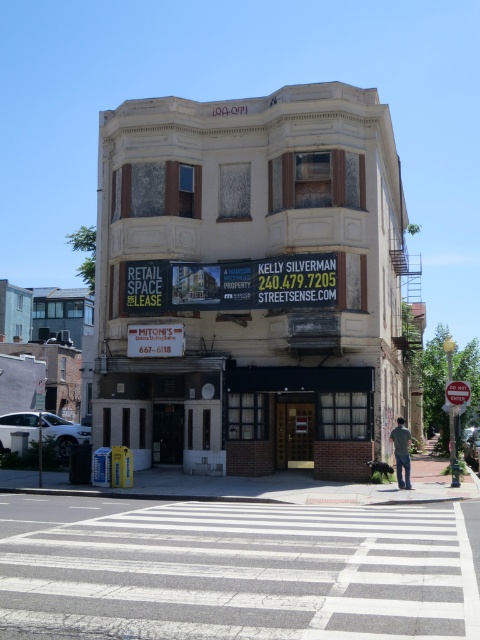
Does white brick building at center have a lesser width compared to gray cotton shirt at lower right?

Incorrect, white brick building at center's width is not less than gray cotton shirt at lower right's.

Does white brick building at center appear on the left side of gray cotton shirt at lower right?

In fact, white brick building at center is to the right of gray cotton shirt at lower right.

Who is more forward, (283, 122) or (394, 433)?

Positioned in front is point (394, 433).

Where is `white brick building at center`? The width and height of the screenshot is (480, 640). white brick building at center is located at coordinates (251, 282).

Is gray cotton shirt at lower right to the left of brushed metal stop sign at center from the viewer's perspective?

Indeed, gray cotton shirt at lower right is positioned on the left side of brushed metal stop sign at center.

Is point (396, 452) in front of point (456, 396)?

Yes, it is.

Which is in front, point (395, 456) or point (464, 381)?

Point (395, 456) is more forward.

You are a GUI agent. You are given a task and a screenshot of the screen. Output one action in this format:
    pyautogui.click(x=<x>, y=<y>)
    Task: Click on the gray cotton shirt at lower right
    
    Given the screenshot: What is the action you would take?
    pyautogui.click(x=402, y=452)

What do you see at coordinates (251, 282) in the screenshot? The image size is (480, 640). I see `white brick building at center` at bounding box center [251, 282].

Which is above, white brick building at center or brushed metal stop sign at center?

white brick building at center is above.

Between point (316, 131) and point (454, 403), which one is positioned in front?

Positioned in front is point (454, 403).

Find the location of `white brick building at center`. white brick building at center is located at coordinates (251, 282).